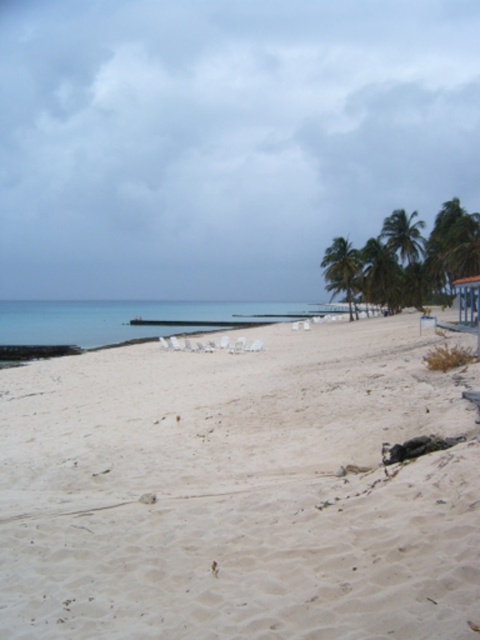
Is blue water at center smaller than green leafy palm tree at right?

Actually, blue water at center might be larger than green leafy palm tree at right.

Is blue water at center below green leafy palm tree at right?

Yes.

Describe the element at coordinates (131, 321) in the screenshot. I see `blue water at center` at that location.

Locate an element on the screen. blue water at center is located at coordinates (131, 321).

Which is above, white sandy beach at lower left or blue water at center?

blue water at center is higher up.

Is white sandy beach at lower left above blue water at center?

No, white sandy beach at lower left is not above blue water at center.

Between point (462, 588) and point (2, 317), which one is positioned in front?

Point (462, 588) is in front.

Find the location of `white sandy beach at lower left`. white sandy beach at lower left is located at coordinates (239, 492).

Is green leafy palm tree at center-right behind green leafy palm tree at upper right?

No, it is not.

Who is lower down, green leafy palm tree at center-right or green leafy palm tree at upper right?

green leafy palm tree at center-right

Which is behind, point (333, 260) or point (398, 211)?

The point (398, 211) is more distant.

The width and height of the screenshot is (480, 640). I want to click on green leafy palm tree at center-right, so click(343, 272).